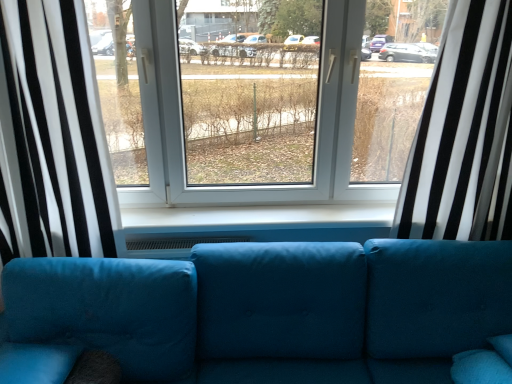
Locate an element on the screen. Image resolution: width=512 pixels, height=384 pixels. white striped curtain at right, which is the second curtain from left to right is located at coordinates point(464,134).

What do you see at coordinates (464, 134) in the screenshot? I see `white striped curtain at right, the 1th curtain when ordered from right to left` at bounding box center [464, 134].

The height and width of the screenshot is (384, 512). Describe the element at coordinates (54, 133) in the screenshot. I see `black/white striped curtain at left, the second curtain positioned from the right` at that location.

Locate an element on the screen. This screenshot has width=512, height=384. velvet blue couch at center is located at coordinates (272, 310).

Is black/white striped curtain at left, marked as the 1th curtain in a left-to-right arrangement, smaller than velvet blue couch at center?

Yes.

Between black/white striped curtain at left, the second curtain positioned from the right, and velvet blue couch at center, which one appears on the right side from the viewer's perspective?

Positioned to the right is velvet blue couch at center.

Image resolution: width=512 pixels, height=384 pixels. There is a velvet blue couch at center. Identify the location of the 1st curtain above it (from the image's perspective). (54, 133).

Is black/white striped curtain at left, the second curtain positioned from the right, completely or partially outside of velvet blue couch at center?

Yes, black/white striped curtain at left, the second curtain positioned from the right, is located beyond the bounds of velvet blue couch at center.

At what (x,y) coordinates should I click in order to perform the action: click on the 2nd curtain above the velvet blue couch at center (from the image's perspective). Please return your answer as a coordinate pair (x, y). The height and width of the screenshot is (384, 512). Looking at the image, I should click on (464, 134).

Can you confirm if velvet blue couch at center is bigger than white striped curtain at right, which is the second curtain from left to right?

Correct, velvet blue couch at center is larger in size than white striped curtain at right, which is the second curtain from left to right.

From the image's perspective, is velvet blue couch at center above white striped curtain at right, which is the second curtain from left to right?

Incorrect, from the image's perspective, velvet blue couch at center is lower than white striped curtain at right, which is the second curtain from left to right.

Is the surface of velvet blue couch at center in direct contact with white striped curtain at right, which is the second curtain from left to right?

No, velvet blue couch at center is not beside white striped curtain at right, which is the second curtain from left to right.

From the image's perspective, which object appears higher, velvet blue couch at center or black/white striped curtain at left, marked as the 1th curtain in a left-to-right arrangement?

black/white striped curtain at left, marked as the 1th curtain in a left-to-right arrangement, from the image's perspective.

Which of these two, velvet blue couch at center or black/white striped curtain at left, the second curtain positioned from the right, is smaller?

Smaller between the two is black/white striped curtain at left, the second curtain positioned from the right.

Is velvet blue couch at center facing away from black/white striped curtain at left, the second curtain positioned from the right?

No.

Can you confirm if velvet blue couch at center is positioned to the right of black/white striped curtain at left, marked as the 1th curtain in a left-to-right arrangement?

Yes, velvet blue couch at center is to the right of black/white striped curtain at left, marked as the 1th curtain in a left-to-right arrangement.

You are a GUI agent. You are given a task and a screenshot of the screen. Output one action in this format:
    pyautogui.click(x=<x>, y=<y>)
    Task: Click on the curtain in front of the white striped curtain at right, which is the second curtain from left to right
    Image resolution: width=512 pixels, height=384 pixels.
    Given the screenshot: What is the action you would take?
    pyautogui.click(x=54, y=133)

Based on the photo, which object is further away from the camera, black/white striped curtain at left, the second curtain positioned from the right, or white striped curtain at right, the 1th curtain when ordered from right to left?

white striped curtain at right, the 1th curtain when ordered from right to left.

From the image's perspective, is black/white striped curtain at left, marked as the 1th curtain in a left-to-right arrangement, under white striped curtain at right, which is the second curtain from left to right?

Correct, black/white striped curtain at left, marked as the 1th curtain in a left-to-right arrangement, appears lower than white striped curtain at right, which is the second curtain from left to right, in the image.

Considering the sizes of objects white striped curtain at right, which is the second curtain from left to right, and black/white striped curtain at left, the second curtain positioned from the right, in the image provided, who is shorter, white striped curtain at right, which is the second curtain from left to right, or black/white striped curtain at left, the second curtain positioned from the right,?

Standing shorter between the two is white striped curtain at right, which is the second curtain from left to right.

From a real-world perspective, is white striped curtain at right, which is the second curtain from left to right, positioned over black/white striped curtain at left, the second curtain positioned from the right, based on gravity?

Indeed, from a real-world perspective, white striped curtain at right, which is the second curtain from left to right, stands above black/white striped curtain at left, the second curtain positioned from the right.

Is white striped curtain at right, the 1th curtain when ordered from right to left, positioned beyond the bounds of black/white striped curtain at left, the second curtain positioned from the right?

Indeed, white striped curtain at right, the 1th curtain when ordered from right to left, is completely outside black/white striped curtain at left, the second curtain positioned from the right.

Considering the positions of point (437, 118) and point (151, 327), is point (437, 118) closer or farther from the camera than point (151, 327)?

Point (437, 118).

Would you say velvet blue couch at center is part of white striped curtain at right, which is the second curtain from left to right,'s contents?

No.

Measure the distance between white striped curtain at right, the 1th curtain when ordered from right to left, and velvet blue couch at center.

They are 62.98 centimeters apart.

Is white striped curtain at right, which is the second curtain from left to right, looking in the opposite direction of velvet blue couch at center?

white striped curtain at right, which is the second curtain from left to right, does not have its back to velvet blue couch at center.

Identify the location of curtain that is the 1st one when counting upward from the velvet blue couch at center (from the image's perspective). (54, 133).

The height and width of the screenshot is (384, 512). I want to click on curtain on the right of velvet blue couch at center, so click(x=464, y=134).

When comparing their distances from white striped curtain at right, the 1th curtain when ordered from right to left, does velvet blue couch at center or black/white striped curtain at left, the second curtain positioned from the right, seem closer?

Among the two, velvet blue couch at center is located nearer to white striped curtain at right, the 1th curtain when ordered from right to left.

Estimate the real-world distances between objects in this image. Which object is closer to white striped curtain at right, which is the second curtain from left to right, black/white striped curtain at left, marked as the 1th curtain in a left-to-right arrangement, or velvet blue couch at center?

Among the two, velvet blue couch at center is located nearer to white striped curtain at right, which is the second curtain from left to right.

Looking at this image, looking at the image, which one is located closer to velvet blue couch at center, black/white striped curtain at left, the second curtain positioned from the right, or white striped curtain at right, the 1th curtain when ordered from right to left?

white striped curtain at right, the 1th curtain when ordered from right to left, is positioned closer to the anchor velvet blue couch at center.

When comparing their distances from black/white striped curtain at left, marked as the 1th curtain in a left-to-right arrangement, does white striped curtain at right, the 1th curtain when ordered from right to left, or velvet blue couch at center seem closer?

Among the two, velvet blue couch at center is located nearer to black/white striped curtain at left, marked as the 1th curtain in a left-to-right arrangement.

Looking at the image, which one is located closer to velvet blue couch at center, white striped curtain at right, which is the second curtain from left to right, or black/white striped curtain at left, the second curtain positioned from the right?

Based on the image, white striped curtain at right, which is the second curtain from left to right, appears to be nearer to velvet blue couch at center.

From the picture: Based on their spatial positions, is velvet blue couch at center or white striped curtain at right, the 1th curtain when ordered from right to left, closer to black/white striped curtain at left, marked as the 1th curtain in a left-to-right arrangement?

velvet blue couch at center.

Locate an element on the screen. studio couch situated between black/white striped curtain at left, the second curtain positioned from the right, and white striped curtain at right, the 1th curtain when ordered from right to left, from left to right is located at coordinates (272, 310).